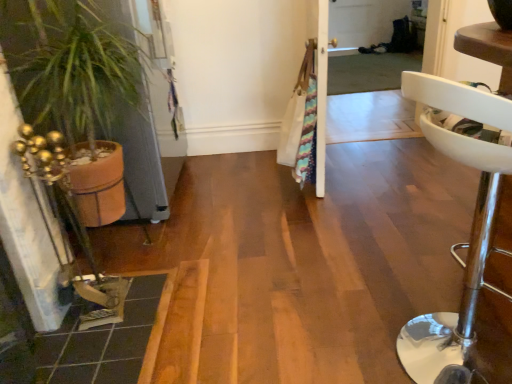
Question: Can you see terracotta pot at left touching white leather stool at right?

Choices:
 (A) yes
 (B) no

Answer: (B)

Question: Is terracotta pot at left facing towards white leather stool at right?

Choices:
 (A) yes
 (B) no

Answer: (B)

Question: Can you confirm if terracotta pot at left is shorter than white leather stool at right?

Choices:
 (A) yes
 (B) no

Answer: (B)

Question: Would you consider terracotta pot at left to be distant from white leather stool at right?

Choices:
 (A) no
 (B) yes

Answer: (B)

Question: Is terracotta pot at left at the right side of white leather stool at right?

Choices:
 (A) no
 (B) yes

Answer: (A)

Question: From a real-world perspective, is terracotta pot at left physically located above or below white leather stool at right?

Choices:
 (A) below
 (B) above

Answer: (B)

Question: Is terracotta pot at left spatially inside white leather stool at right, or outside of it?

Choices:
 (A) outside
 (B) inside

Answer: (A)

Question: Does point (5, 43) appear closer or farther from the camera than point (474, 221)?

Choices:
 (A) farther
 (B) closer

Answer: (A)

Question: From the image's perspective, is terracotta pot at left located above or below white leather stool at right?

Choices:
 (A) above
 (B) below

Answer: (A)

Question: Is point (477, 251) closer or farther from the camera than point (411, 129)?

Choices:
 (A) closer
 (B) farther

Answer: (A)

Question: From a real-world perspective, is white leather stool at right physically located above or below transparent plastic screen door at upper center?

Choices:
 (A) above
 (B) below

Answer: (B)

Question: Considering the positions of white leather stool at right and transparent plastic screen door at upper center in the image, is white leather stool at right wider or thinner than transparent plastic screen door at upper center?

Choices:
 (A) thin
 (B) wide

Answer: (B)

Question: Which is correct: white leather stool at right is inside transparent plastic screen door at upper center, or outside of it?

Choices:
 (A) outside
 (B) inside

Answer: (A)

Question: In the image, is transparent plastic screen door at upper center positioned in front of or behind terracotta pot at left?

Choices:
 (A) front
 (B) behind

Answer: (B)

Question: From a real-world perspective, is transparent plastic screen door at upper center physically located above or below terracotta pot at left?

Choices:
 (A) below
 (B) above

Answer: (A)